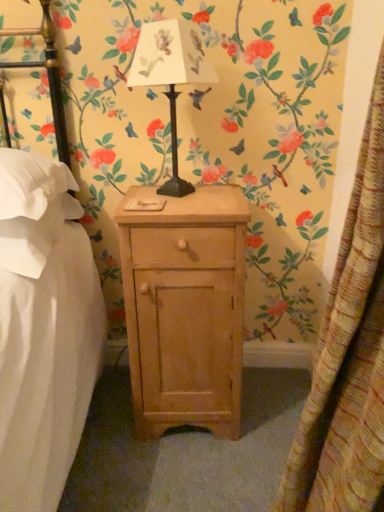
What are the coordinates of `empty space that is ontop of light wood nightstand at center (from a real-world perspective)` in the screenshot? It's located at coord(186,202).